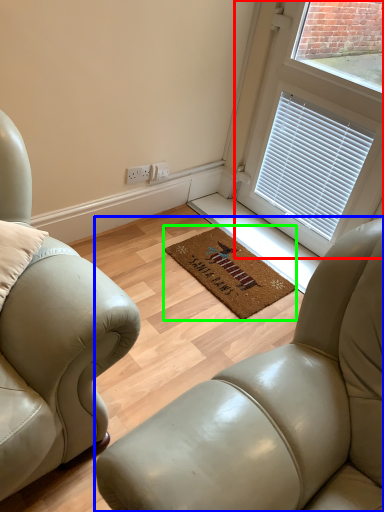
Question: Based on their relative distances, which object is nearer to window (highlighted by a red box)? Choose from studio couch (highlighted by a blue box) and mat (highlighted by a green box).

Choices:
 (A) studio couch
 (B) mat

Answer: (B)